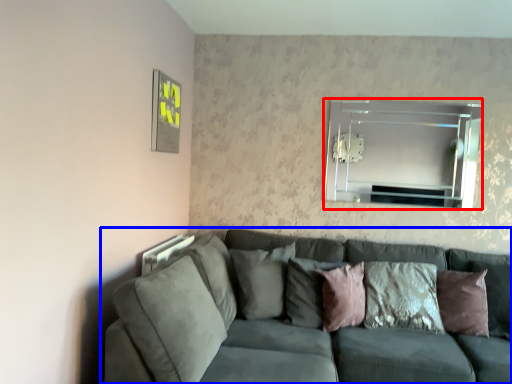
Question: Among these objects, which one is nearest to the camera, mirror (highlighted by a red box) or studio couch (highlighted by a blue box)?

Choices:
 (A) mirror
 (B) studio couch

Answer: (B)